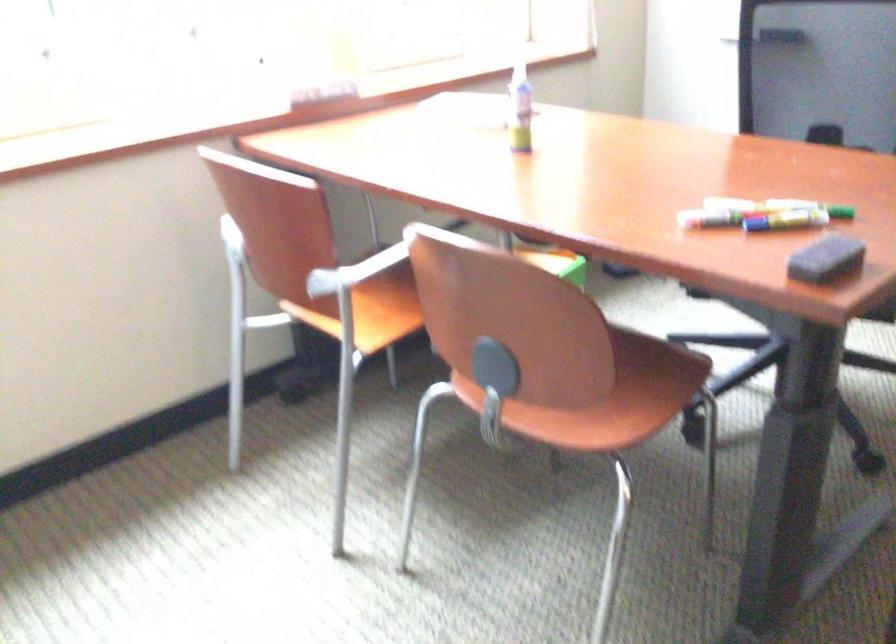
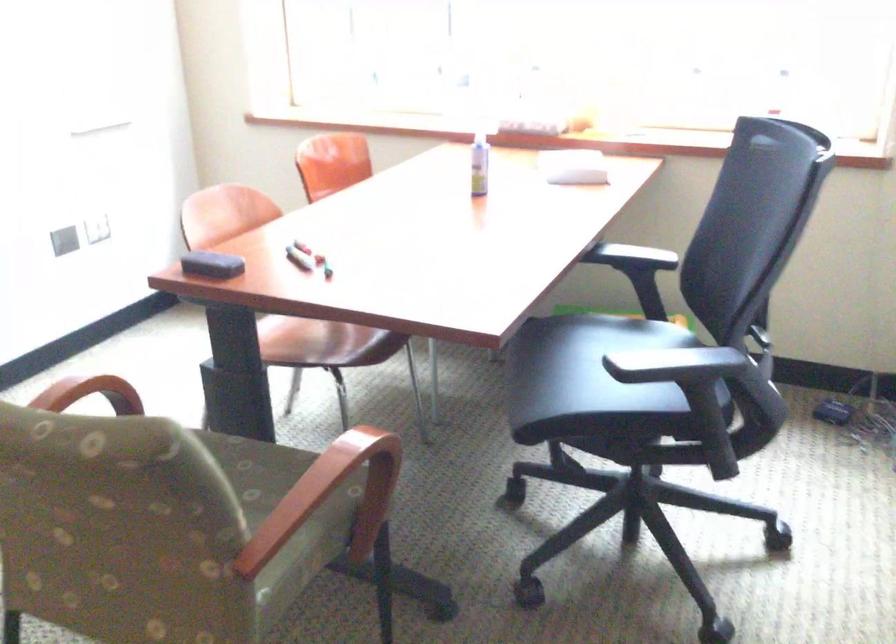
In the second image, find the point that corresponds to point 711,146 in the first image.

(632, 257)